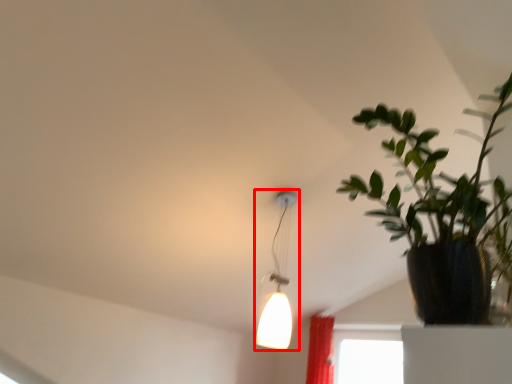
Question: Considering the relative positions of lamp (annotated by the red box) and houseplant in the image provided, where is lamp (annotated by the red box) located with respect to the staircase?

Choices:
 (A) left
 (B) right

Answer: (A)